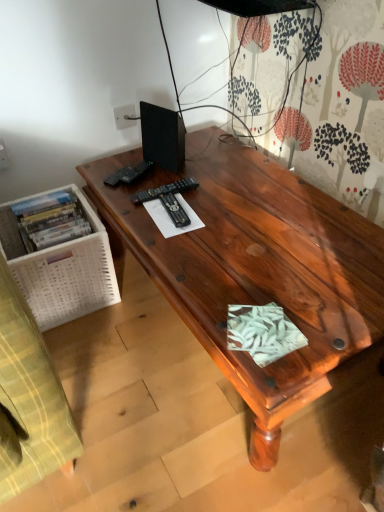
You are a GUI agent. You are given a task and a screenshot of the screen. Output one action in this format:
    pyautogui.click(x=<x>, y=<y>)
    Task: Click on the vacant space situated on the left part of black plastic remote control at center, acting as the second remote control starting from the front
    The height and width of the screenshot is (512, 384).
    Given the screenshot: What is the action you would take?
    (123, 192)